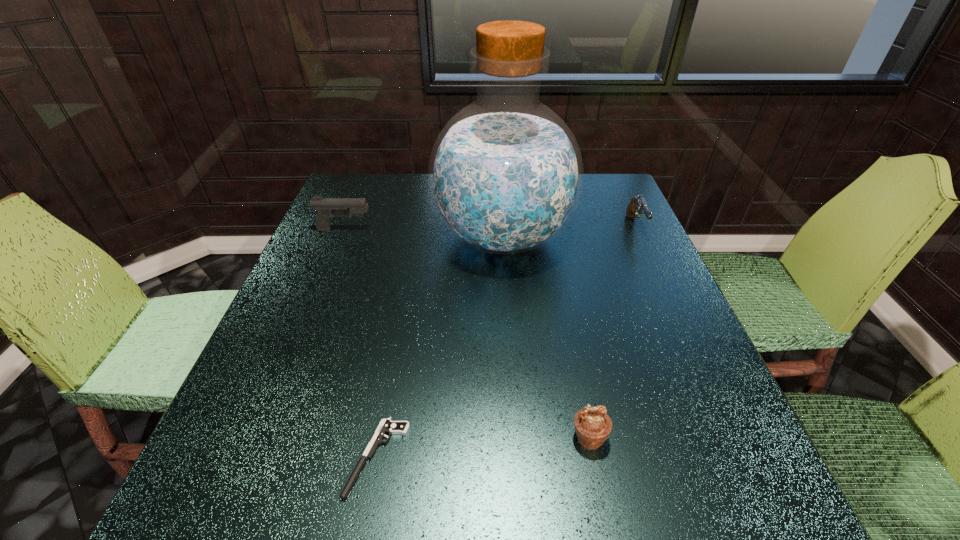
Identify the location of water jug. This screenshot has width=960, height=540. [505, 176].

The image size is (960, 540). I want to click on the leftmost pistol, so click(326, 207).

What are the coordinates of `the rightmost pistol` in the screenshot? It's located at (638, 204).

Locate an element on the screen. muffin is located at coordinates (592, 424).

At what (x,y) coordinates should I click in order to perform the action: click on the shortest object. Please return your answer as a coordinate pair (x, y). The height and width of the screenshot is (540, 960). Looking at the image, I should click on (387, 426).

The image size is (960, 540). In order to click on the second pistol from left to right in this screenshot , I will do tap(387, 426).

What are the coordinates of `free spot located on the right of the tallest object` in the screenshot? It's located at (626, 237).

I want to click on free space located at the barrel of the leftmost object, so click(420, 230).

Where is `vacant space situated at the barrel of the rightmost pistol`? The height and width of the screenshot is (540, 960). vacant space situated at the barrel of the rightmost pistol is located at coordinates tap(655, 269).

Locate an element on the screen. vacant space located on the back of the muffin is located at coordinates (575, 369).